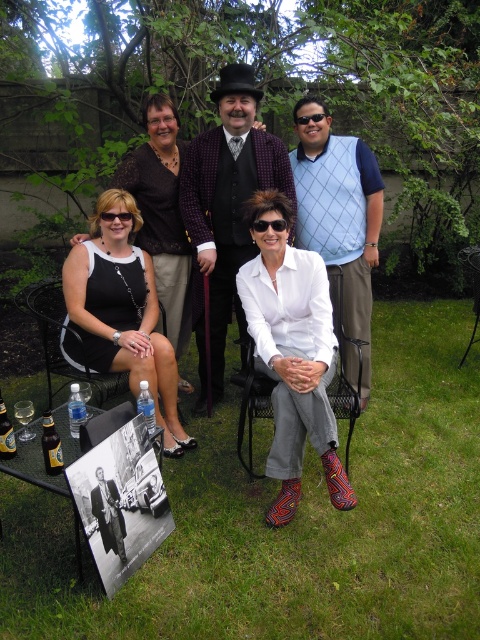
Between point (111, 260) and point (40, 330), which one is positioned in front?

Point (40, 330)

Can you confirm if black satin dress at center is positioned to the left of black mesh chair at left?

Incorrect, black satin dress at center is not on the left side of black mesh chair at left.

Describe the element at coordinates (120, 314) in the screenshot. I see `black satin dress at center` at that location.

Identify the location of black satin dress at center. (120, 314).

Which is behind, point (251, 444) or point (262, 230)?

The point (251, 444) is behind.

Does black mesh chair at center have a greater height compared to black plastic sunglasses at center?

Indeed, black mesh chair at center has a greater height compared to black plastic sunglasses at center.

Find the location of a particular element. The height and width of the screenshot is (640, 480). black mesh chair at center is located at coordinates [x=343, y=365].

Image resolution: width=480 pixels, height=640 pixels. What do you see at coordinates (226, 211) in the screenshot?
I see `plaid wool coat at center` at bounding box center [226, 211].

Who is more distant from viewer, (204, 262) or (327, 248)?

The point (327, 248) is behind.

Find the location of `plaid wool coat at center`. plaid wool coat at center is located at coordinates (226, 211).